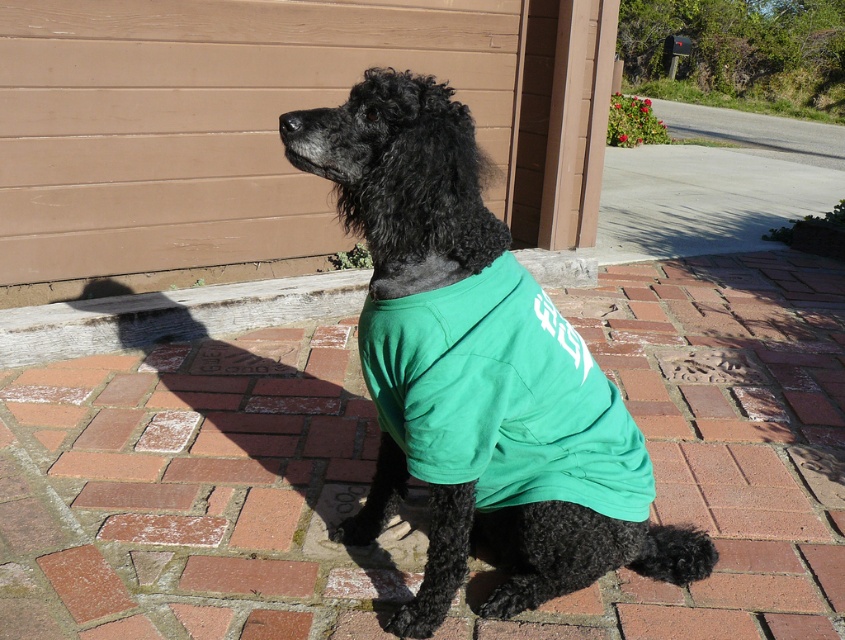
You are a photographer trying to capture a clear shot of the shiny black poodle at center and the green fabric shirt at center. Since the text on the shirt is hard to read, you want to adjust your angle to make the text more visible. Which object should you move closer to the light source to improve readability?

The green fabric shirt at center should be moved closer to the light source since the shiny black poodle at center is positioned on the left side of it, so adjusting the shirt closer to the light would improve text readability.

You are a photographer trying to capture the shiny black poodle at center and the green fabric shirt at center in a single shot. Since the poodle is closer to you, will the shirt appear smaller or larger in the photo compared to the poodle?

The green fabric shirt at center appears smaller in the photo because the shiny black poodle at center is closer to the viewer, making the shirt farther away and thus smaller in comparison.

Consider the image. You are standing 6 feet away from the shiny black poodle at center. If you want to take a closer photo without moving the dog, should you zoom in or move closer?

The shiny black poodle at center is 5.90 feet away from the camera. Since you are already standing 6 feet away, which is slightly further than the dog from the camera, you can move a little closer to take a better photo instead of zooming in.